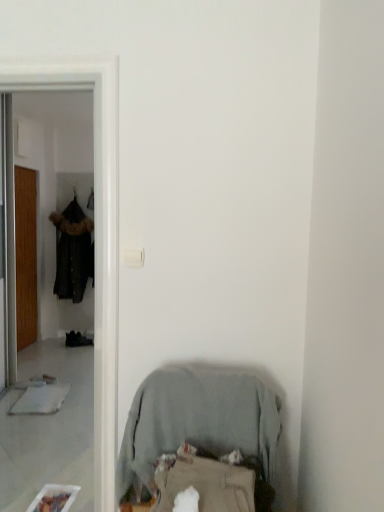
Question: Is dark brown fur-trimmed coat at left surrounded by light gray fabric chair at lower center?

Choices:
 (A) yes
 (B) no

Answer: (B)

Question: Considering the relative positions of light gray fabric chair at lower center and dark brown fur-trimmed coat at left in the image provided, is light gray fabric chair at lower center to the right of dark brown fur-trimmed coat at left from the viewer's perspective?

Choices:
 (A) yes
 (B) no

Answer: (A)

Question: Considering the relative sizes of light gray fabric chair at lower center and dark brown fur-trimmed coat at left in the image provided, is light gray fabric chair at lower center smaller than dark brown fur-trimmed coat at left?

Choices:
 (A) no
 (B) yes

Answer: (B)

Question: Is light gray fabric chair at lower center not inside dark brown fur-trimmed coat at left?

Choices:
 (A) yes
 (B) no

Answer: (A)

Question: Does light gray fabric chair at lower center come behind dark brown fur-trimmed coat at left?

Choices:
 (A) yes
 (B) no

Answer: (B)

Question: In terms of width, does wooden door at left look wider or thinner when compared to dark brown fur-trimmed coat at left?

Choices:
 (A) thin
 (B) wide

Answer: (A)

Question: From a real-world perspective, relative to dark brown fur-trimmed coat at left, is wooden door at left vertically above or below?

Choices:
 (A) below
 (B) above

Answer: (A)

Question: Which is correct: wooden door at left is inside dark brown fur-trimmed coat at left, or outside of it?

Choices:
 (A) outside
 (B) inside

Answer: (A)

Question: Considering their positions, is wooden door at left located in front of or behind dark brown fur-trimmed coat at left?

Choices:
 (A) front
 (B) behind

Answer: (A)

Question: Is wooden door at left situated inside light gray fabric chair at lower center or outside?

Choices:
 (A) outside
 (B) inside

Answer: (A)

Question: In terms of width, does wooden door at left look wider or thinner when compared to light gray fabric chair at lower center?

Choices:
 (A) thin
 (B) wide

Answer: (A)

Question: From the image's perspective, is wooden door at left above or below light gray fabric chair at lower center?

Choices:
 (A) above
 (B) below

Answer: (A)

Question: From a real-world perspective, is wooden door at left physically located above or below light gray fabric chair at lower center?

Choices:
 (A) above
 (B) below

Answer: (A)

Question: In the image, is dark brown fur-trimmed coat at left positioned in front of or behind wooden door at left?

Choices:
 (A) behind
 (B) front

Answer: (A)

Question: Considering the positions of dark brown fur-trimmed coat at left and wooden door at left in the image, is dark brown fur-trimmed coat at left taller or shorter than wooden door at left?

Choices:
 (A) short
 (B) tall

Answer: (A)